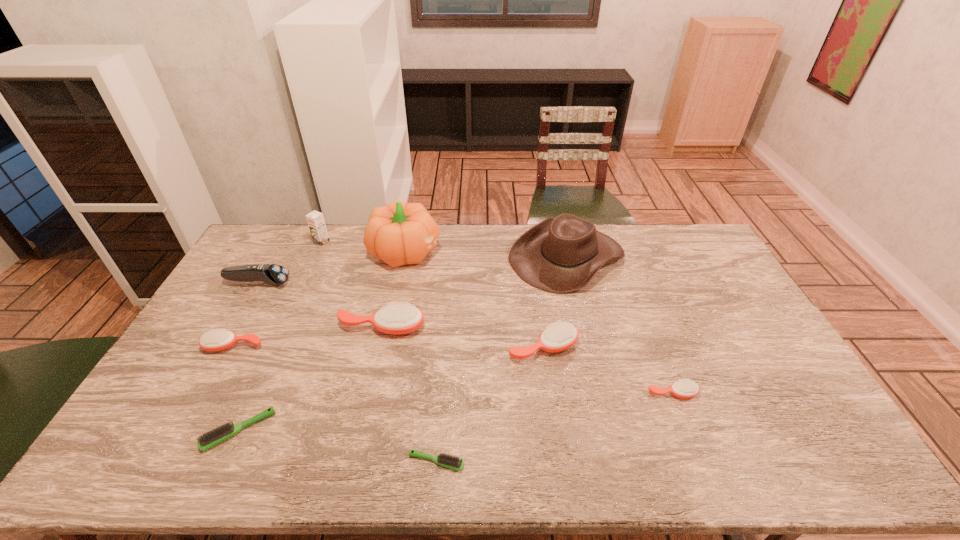
I want to click on free space located on the back of the tallest hairbrush, so click(395, 268).

The image size is (960, 540). What are the coordinates of `free space located on the front of the fifth hairbrush from left to right` in the screenshot? It's located at (549, 394).

This screenshot has height=540, width=960. Identify the location of vacant region located on the right of the third biggest orange hairbrush. (390, 346).

At what (x,y) coordinates should I click in order to perform the action: click on vacant space located 0.310m on the left of the third nearest object. Please return your answer as a coordinate pair (x, y). Looking at the image, I should click on (534, 393).

This screenshot has height=540, width=960. I want to click on free spot located on the back of the second shortest hairbrush, so click(270, 361).

You are a GUI agent. You are given a task and a screenshot of the screen. Output one action in this format:
    pyautogui.click(x=<x>, y=<y>)
    Task: Click on the vacant space located 0.190m on the right of the shortest object
    
    Given the screenshot: What is the action you would take?
    pyautogui.click(x=543, y=462)

Where is `pumpkin located in the far edge section of the desktop`? The width and height of the screenshot is (960, 540). pumpkin located in the far edge section of the desktop is located at coordinates pos(400,233).

Identify the location of cowboy hat at the far edge. (559, 255).

You are a GUI agent. You are given a task and a screenshot of the screen. Output one action in this format:
    pyautogui.click(x=<x>, y=<y>)
    Task: Click on the chocolate milk located in the far edge section of the desktop
    The image size is (960, 540).
    Given the screenshot: What is the action you would take?
    pyautogui.click(x=315, y=219)

The width and height of the screenshot is (960, 540). I want to click on electric shaver that is at the left edge, so click(x=273, y=274).